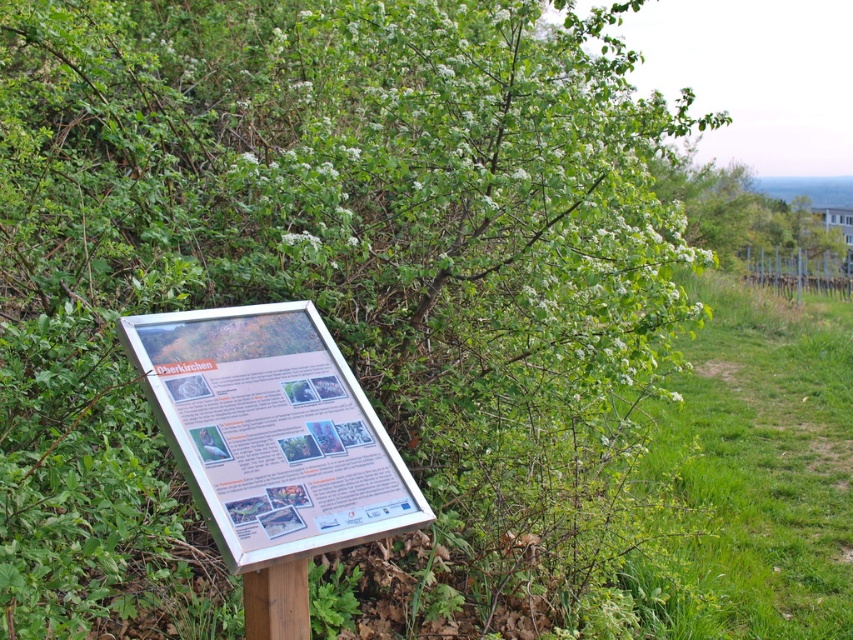
Question: Can you confirm if white paper sign at center is bigger than brown wooden pole at lower center?

Choices:
 (A) yes
 (B) no

Answer: (A)

Question: Which of the following is the farthest from the observer?

Choices:
 (A) brown wooden pole at lower center
 (B) white paper sign at center

Answer: (A)

Question: Is white paper sign at center positioned in front of brown wooden pole at lower center?

Choices:
 (A) yes
 (B) no

Answer: (A)

Question: Among these objects, which one is nearest to the camera?

Choices:
 (A) brown wooden pole at lower center
 (B) white paper sign at center

Answer: (B)

Question: Which point appears closest to the camera in this image?

Choices:
 (A) (260, 460)
 (B) (259, 612)

Answer: (A)

Question: Does white paper sign at center appear under brown wooden pole at lower center?

Choices:
 (A) no
 (B) yes

Answer: (A)